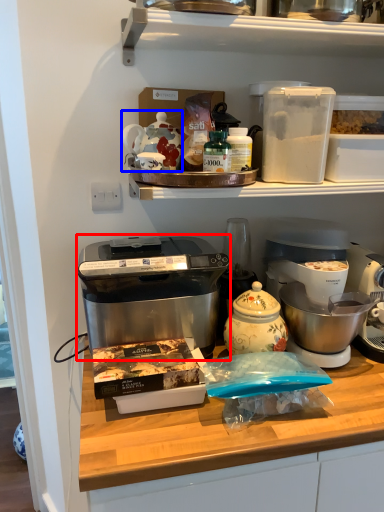
Question: Which of the following is the closest to the observer, home appliance (highlighted by a red box) or appliance (highlighted by a blue box)?

Choices:
 (A) home appliance
 (B) appliance

Answer: (A)